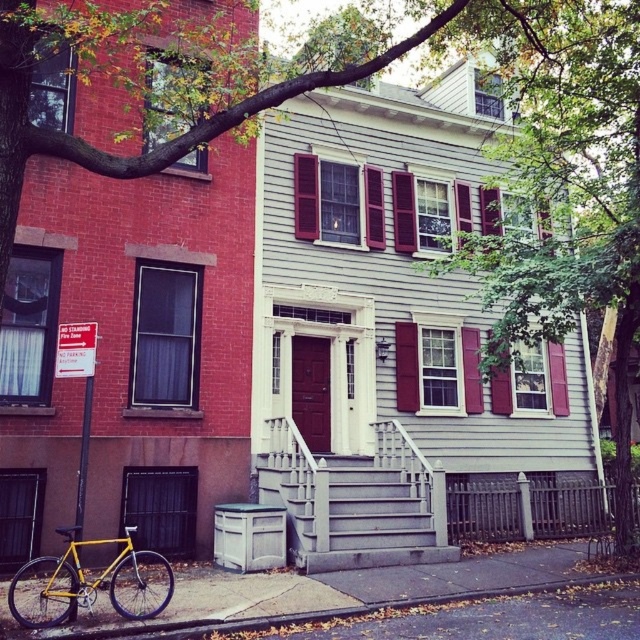
Is gray wooden stairs at center smaller than yellow matte bicycle at lower left?

No, gray wooden stairs at center is not smaller than yellow matte bicycle at lower left.

Who is more distant from viewer, (326, 547) or (68, 563)?

Positioned behind is point (326, 547).

This screenshot has width=640, height=640. In order to click on gray wooden stairs at center in this screenshot , I will do pyautogui.click(x=355, y=516).